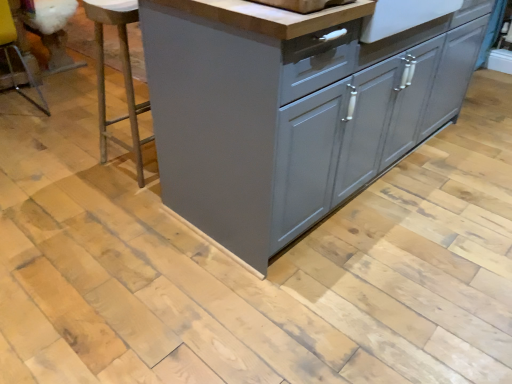
The width and height of the screenshot is (512, 384). In order to click on free area behind clear plastic bar stool at left, the second bar stool viewed from the right in this screenshot , I will do `click(56, 88)`.